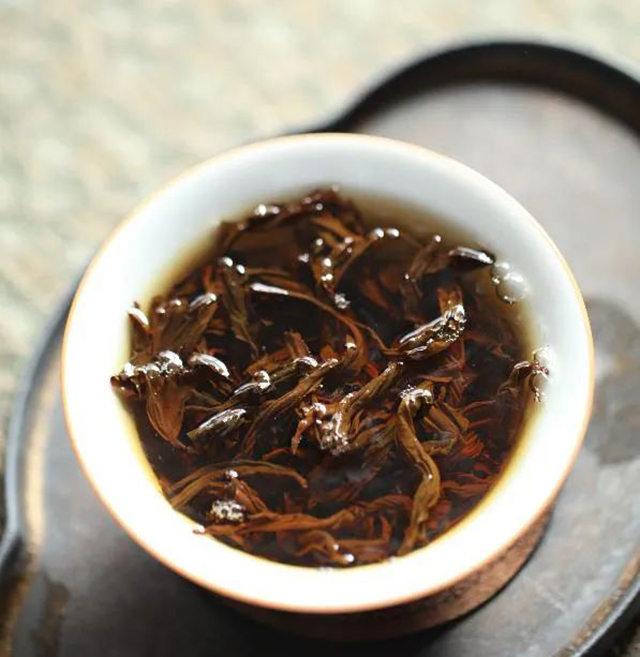
You are a GUI agent. You are given a task and a screenshot of the screen. Output one action in this format:
    pyautogui.click(x=<x>, y=<y>)
    Task: Click on the tea tray plate
    Image resolution: width=640 pixels, height=657 pixels.
    Given the screenshot: What is the action you would take?
    pyautogui.click(x=64, y=520)